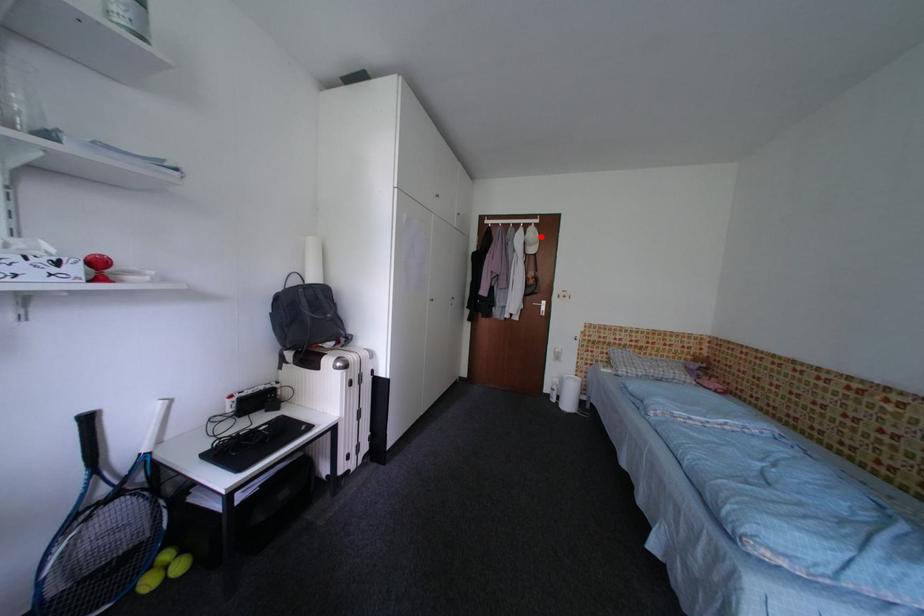
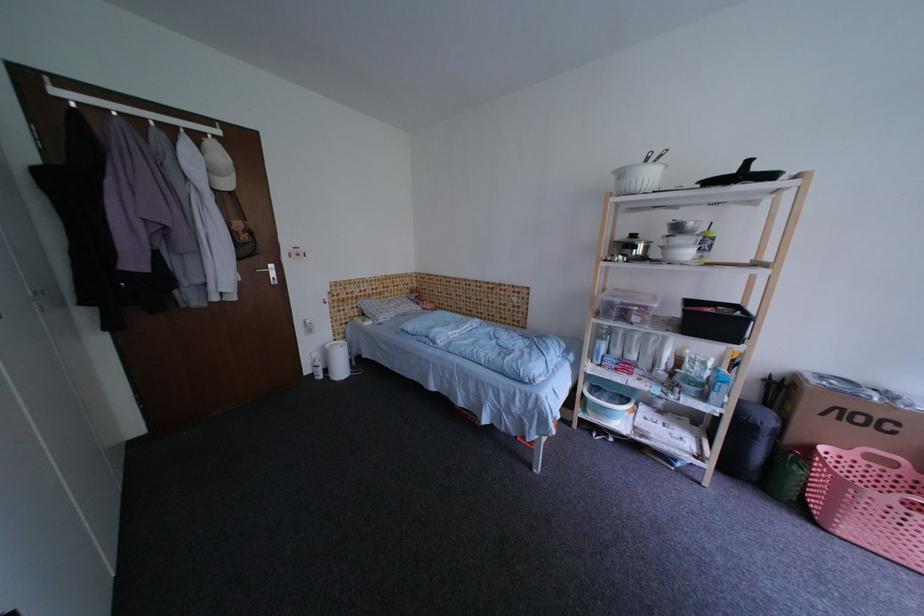
Question: I am providing you with two images of the same scene from different viewpoints. Image1 has a red point marked. In image2, the corresponding 3D location appears at what relative position? Reply with the corresponding letter.

Choices:
 (A) Closer
 (B) Farther

Answer: (B)